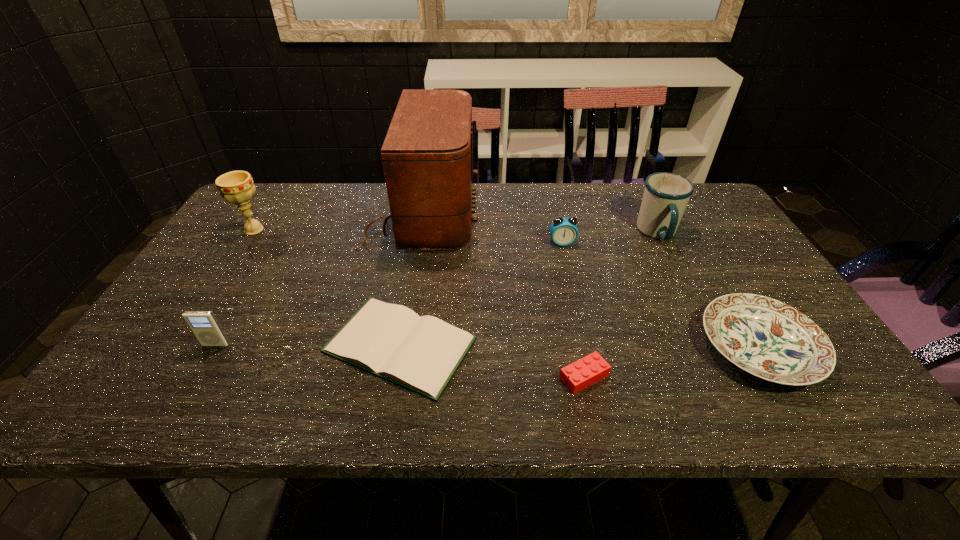
Locate an element on the screen. vacant region between the Lego and the alarm clock is located at coordinates (573, 310).

At what (x,y) coordinates should I click in order to perform the action: click on vacant point located between the iPod and the fifth tallest object. Please return your answer as a coordinate pair (x, y). This screenshot has width=960, height=540. Looking at the image, I should click on (389, 294).

Identify the location of free space between the hardback book and the mug. This screenshot has height=540, width=960. (529, 289).

Identify the location of free space between the shortest object and the fourth tallest object. (308, 345).

Where is `object that is the fourth closest to the Lego`? Image resolution: width=960 pixels, height=540 pixels. object that is the fourth closest to the Lego is located at coordinates (563, 231).

Point out which object is positioned as the nearest to the sixth tallest object. Please provide its 2D coordinates. Your answer should be formatted as a tuple, i.e. [(x, y)], where the tuple contains the x and y coordinates of a point satisfying the conditions above.

[(666, 195)]

You are a GUI agent. You are given a task and a screenshot of the screen. Output one action in this format:
    pyautogui.click(x=<x>, y=<y>)
    Task: Click on the vacant position in the image that satisfies the following two spatial constraints: 1. on the front panel of the radio receiver; 2. on the back side of the seventh tallest object
    This screenshot has height=540, width=960.
    Given the screenshot: What is the action you would take?
    pyautogui.click(x=393, y=376)

This screenshot has height=540, width=960. I want to click on blank space that satisfies the following two spatial constraints: 1. on the face of the third shortest object; 2. on the right side of the fifth tallest object, so click(x=586, y=348).

This screenshot has width=960, height=540. Identify the location of vacant space that satisfies the following two spatial constraints: 1. on the handle side of the plate; 2. on the left side of the mug. (715, 348).